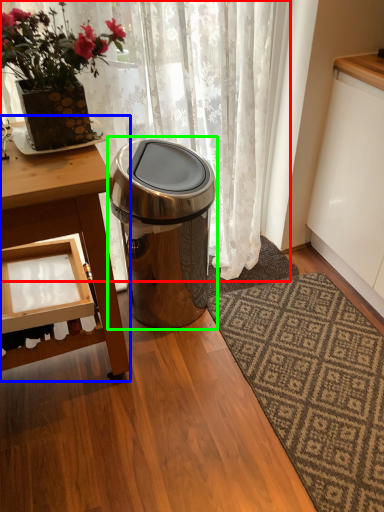
Question: Which object is positioned farthest from curtain (highlighted by a red box)? Select from table (highlighted by a blue box) and trash bin/can (highlighted by a green box).

Choices:
 (A) table
 (B) trash bin/can

Answer: (A)